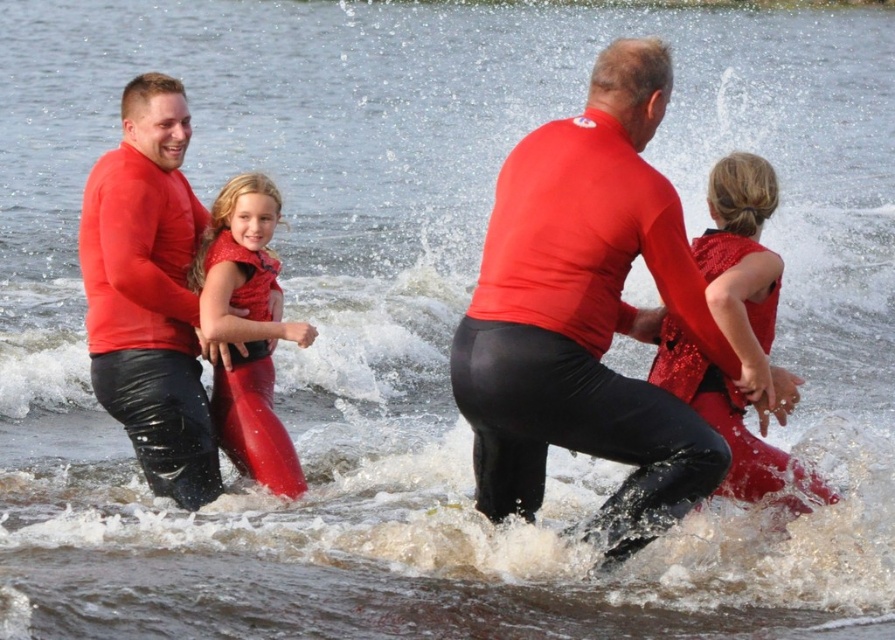
Does matte red wetsuit at center lie behind shiny sequined vest at center?

That is False.

Who is positioned more to the right, matte red wetsuit at center or shiny sequined vest at center?

Positioned to the right is shiny sequined vest at center.

I want to click on matte red wetsuit at center, so click(587, 314).

Between matte red wetsuit at left and shiny red life jacket at center, which one is positioned lower?

shiny red life jacket at center is below.

Does matte red wetsuit at left appear on the left side of shiny red life jacket at center?

Indeed, matte red wetsuit at left is positioned on the left side of shiny red life jacket at center.

Who is more distant from viewer, (173, 237) or (766, 308)?

The point (173, 237) is behind.

The image size is (895, 640). I want to click on matte red wetsuit at left, so click(x=149, y=292).

Does matte red wetsuit at center have a lesser width compared to shiny red life jacket at center?

No, matte red wetsuit at center is not thinner than shiny red life jacket at center.

Does matte red wetsuit at center have a greater width compared to shiny red life jacket at center?

Yes.

Which is behind, point (487, 410) or point (736, 404)?

The point (736, 404) is behind.

This screenshot has height=640, width=895. Identify the location of matte red wetsuit at center. (587, 314).